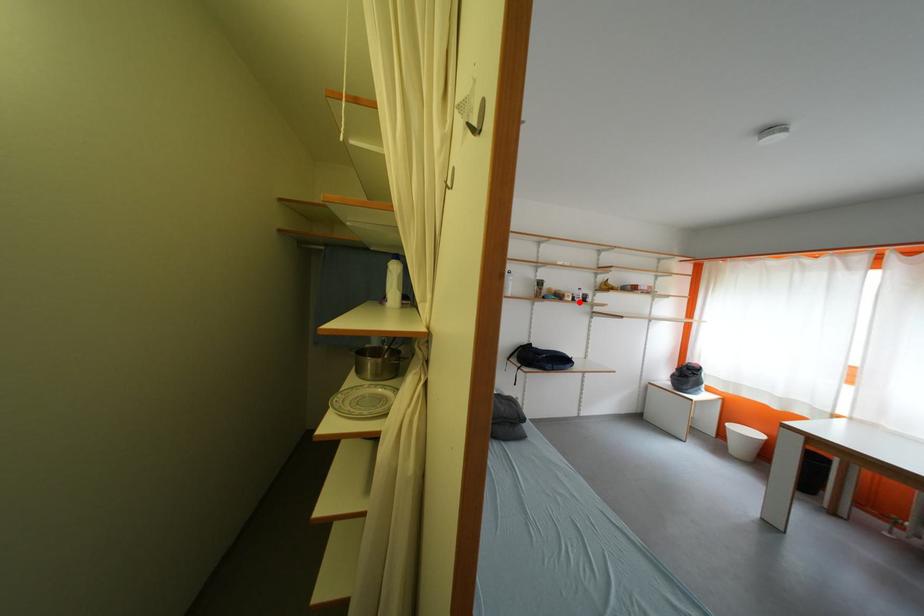
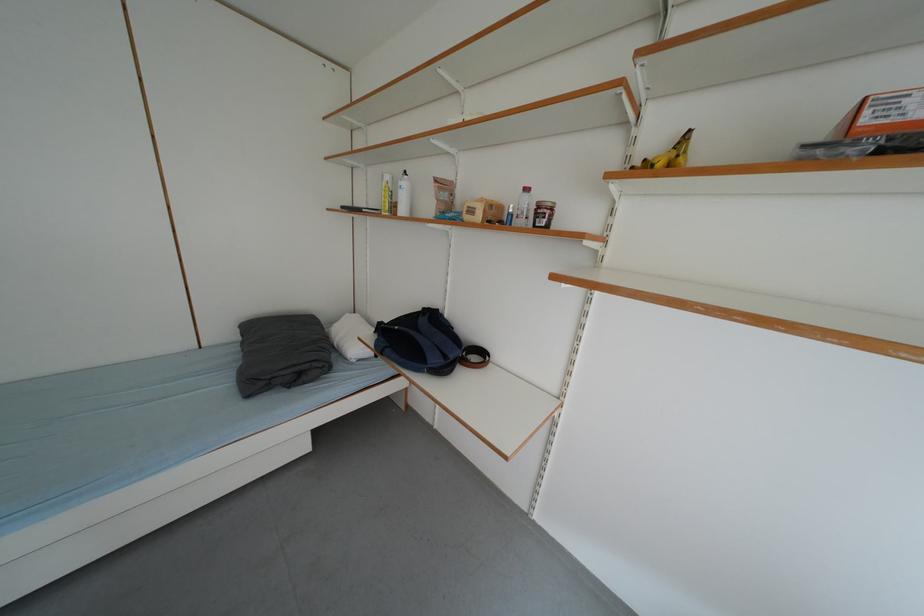
The point at the highlighted location is marked in the first image. Where is the corresponding point in the second image?

(487, 220)